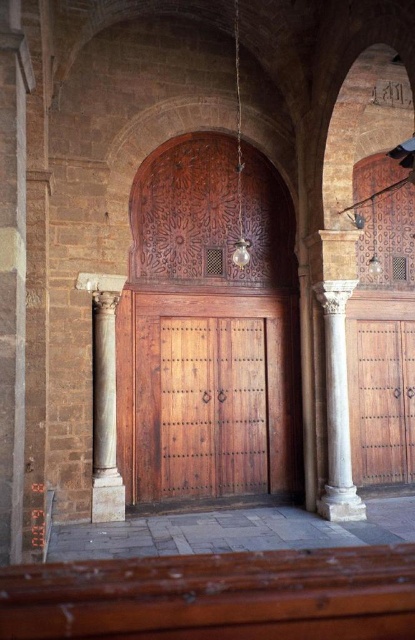
You are an architect examining the entrance of a historical building. You notice two doors in the image. The wooden door at center and the polished wood door at right. Which door is located higher up in the image?

The wooden door at center is positioned over the polished wood door at right, meaning it is higher up in the image.

You are standing in front of the wooden door and want to move from point A to point B. If point A is at coordinate point(x=398, y=420) and point B is at coordinate point(x=104, y=324), will you walk towards the door or away from it?

Since point(x=398, y=420) is behind point(x=104, y=324), moving from point A to point B means you are walking towards the door.